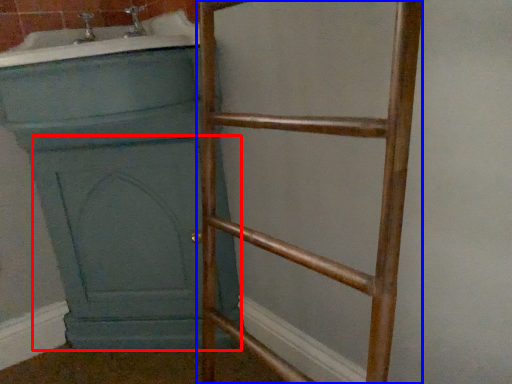
Question: Which object is further to the camera taking this photo, screen door (highlighted by a red box) or ladder (highlighted by a blue box)?

Choices:
 (A) screen door
 (B) ladder

Answer: (A)